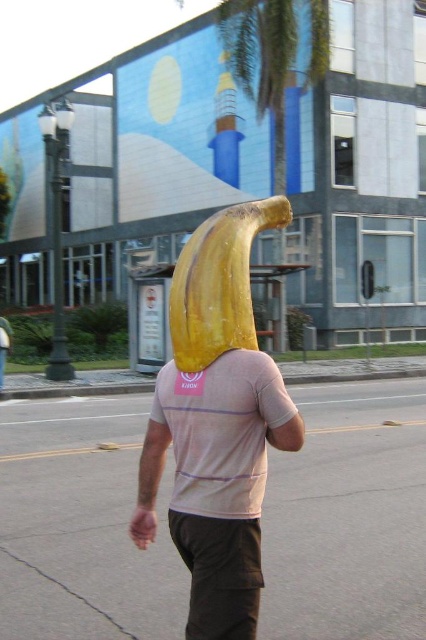
You are a photographer trying to capture the yellow rubber banana at center in the image. The camera you are using has a focal point at coordinates 0.662, 0.509. Will the banana be in focus?

Yes, the yellow rubber banana at center is exactly at the focal point coordinates (216,422), so it will be in focus.

You are a photographer trying to capture the person with the banana on their head. You notice there are two bananas at the center of the image. Which banana is closer to you, the yellow rubber banana at center or the yellow matte banana at center?

The yellow rubber banana at center is closer to the viewer than the yellow matte banana at center, so the yellow rubber banana at center is the one closer to you.